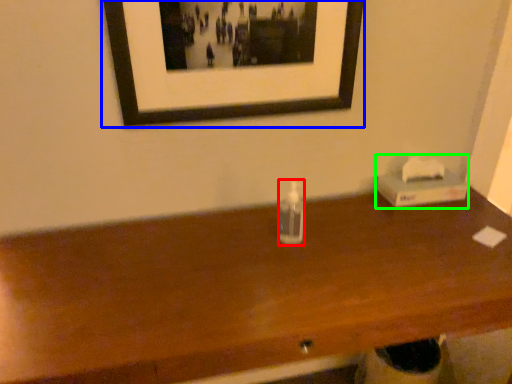
Question: Which object is the farthest from bottle (highlighted by a red box)? Choose among these: picture frame (highlighted by a blue box) or box (highlighted by a green box).

Choices:
 (A) picture frame
 (B) box

Answer: (B)